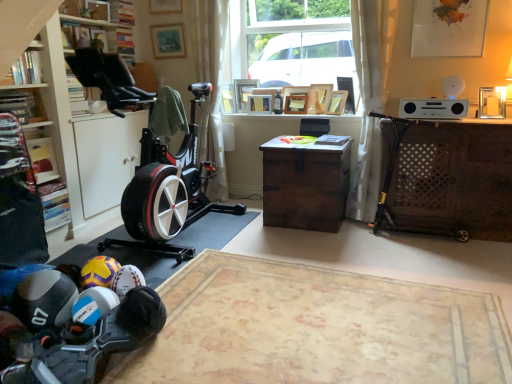
I want to click on vacant space situated on the left part of brown wooden desk at center, positioned as the second desk in right-to-left order, so click(x=227, y=226).